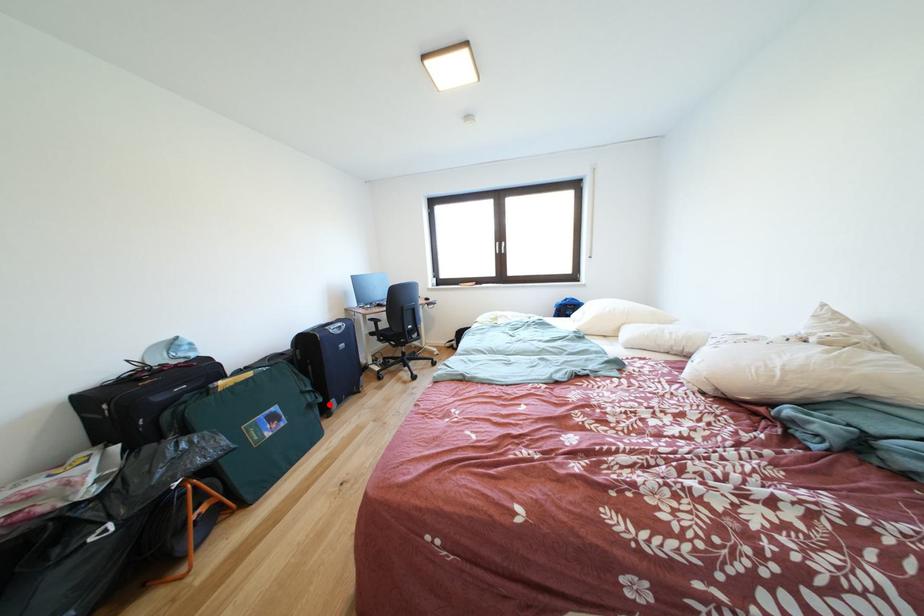
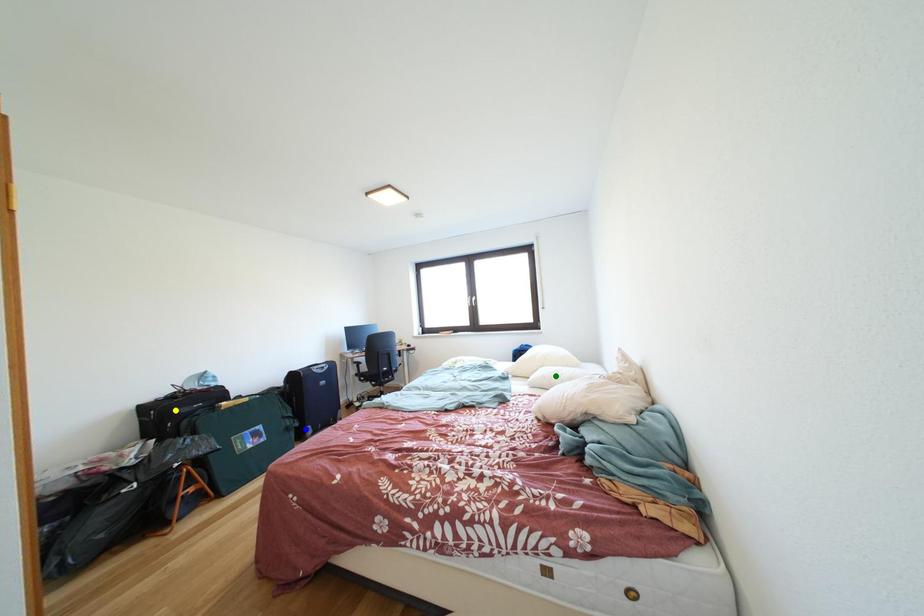
Question: I am providing you with two images of the same scene from different viewpoints. A red point is marked on the first image. You are given multiple points on the second image. Which point in image 2 represents the same 3d spot as the red point in image 1?

Choices:
 (A) green point
 (B) blue point
 (C) yellow point

Answer: (B)